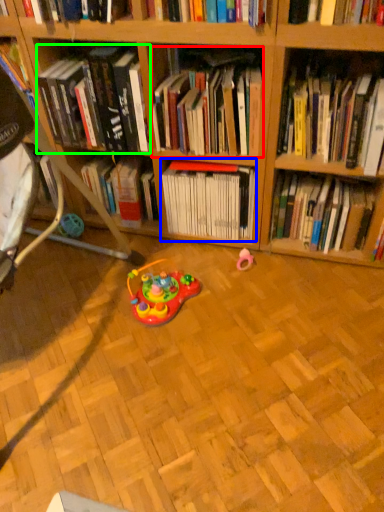
Question: Which object is the closest to the book (highlighted by a red box)? Choose among these: book (highlighted by a blue box) or book (highlighted by a green box).

Choices:
 (A) book
 (B) book

Answer: (B)